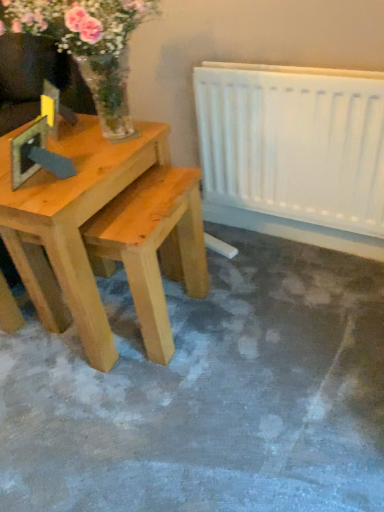
Image resolution: width=384 pixels, height=512 pixels. What are the coordinates of `vacant space situated above light brown wood table at left (from a real-world perspective)` in the screenshot? It's located at (67, 154).